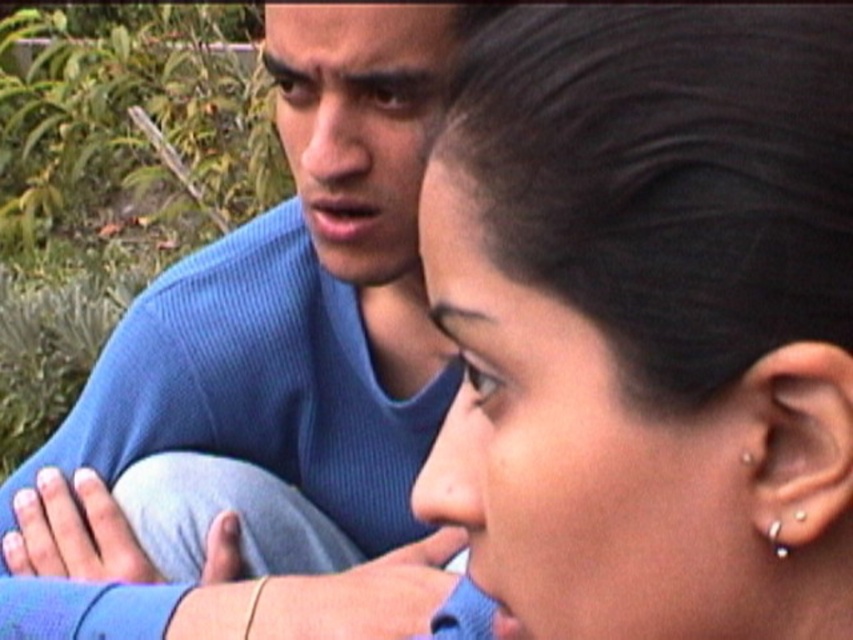
Question: Does matte blue forehead at upper center appear on the left side of silver metallic earring at ear?

Choices:
 (A) yes
 (B) no

Answer: (A)

Question: Where is black hair at upper center located in relation to silver metallic earring at ear in the image?

Choices:
 (A) left
 (B) right

Answer: (A)

Question: Which object appears farthest from the camera in this image?

Choices:
 (A) matte blue forehead at upper center
 (B) blue ribbed sweater at upper left
 (C) silver metallic earring at ear

Answer: (A)

Question: Among these points, which one is farthest from the camera?

Choices:
 (A) (657, 224)
 (B) (776, 531)
 (C) (344, 51)
 (D) (363, 582)

Answer: (D)

Question: From the image, what is the correct spatial relationship of black hair at upper center in relation to matte blue forehead at upper center?

Choices:
 (A) left
 (B) right

Answer: (B)

Question: Which point is closer to the camera?

Choices:
 (A) (247, 545)
 (B) (402, 49)
 (C) (775, 538)

Answer: (C)